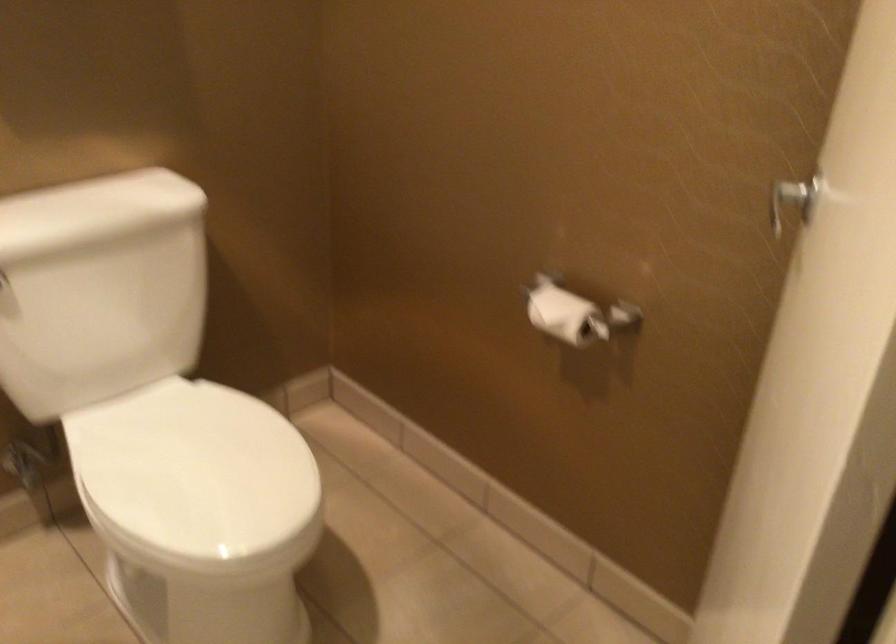
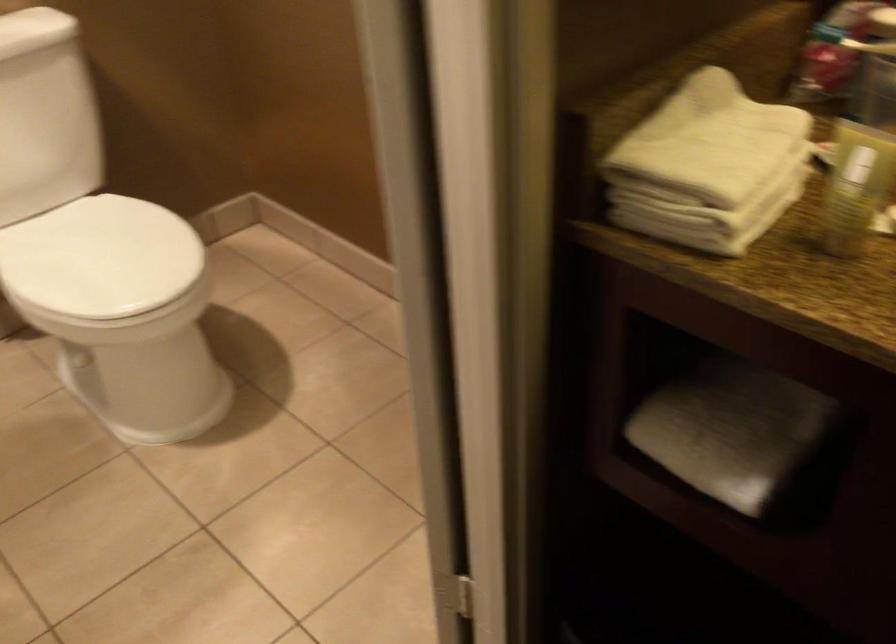
Where in the second image is the point corresponding to pixel 201 469 from the first image?

(99, 257)